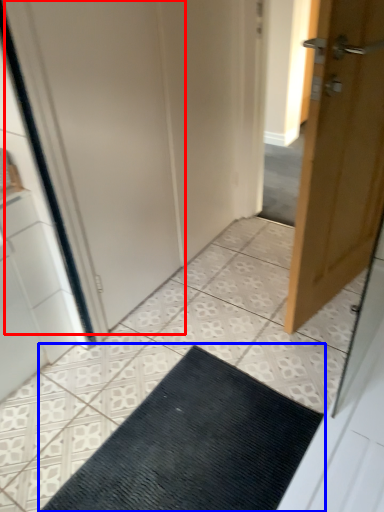
Question: Which object is further to the camera taking this photo, screen door (highlighted by a red box) or doormat (highlighted by a blue box)?

Choices:
 (A) screen door
 (B) doormat

Answer: (A)